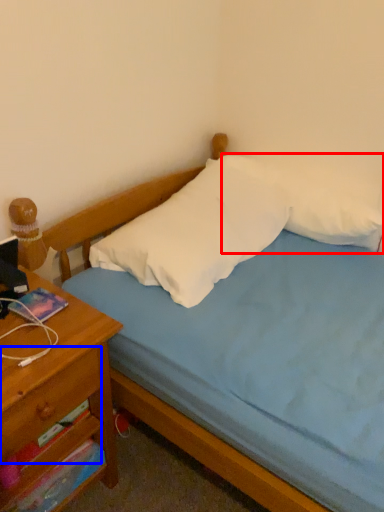
Question: Which of the following is the farthest to the observer, pillow (highlighted by a red box) or drawer (highlighted by a blue box)?

Choices:
 (A) pillow
 (B) drawer

Answer: (A)